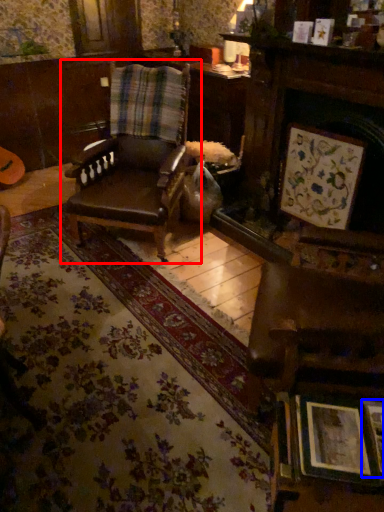
Question: Which of the following is the farthest to the observer, chair (highlighted by a red box) or picture frame (highlighted by a blue box)?

Choices:
 (A) chair
 (B) picture frame

Answer: (A)